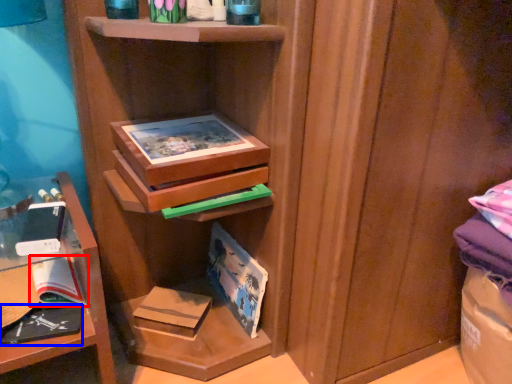
Question: Which object is closer to the camera taking this photo, paperback book (highlighted by a red box) or book (highlighted by a blue box)?

Choices:
 (A) paperback book
 (B) book

Answer: (B)